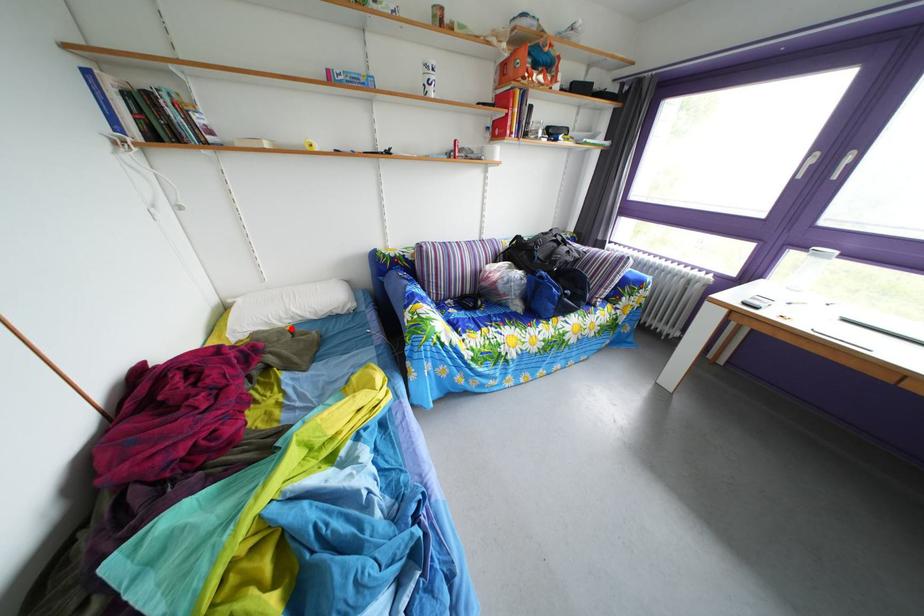
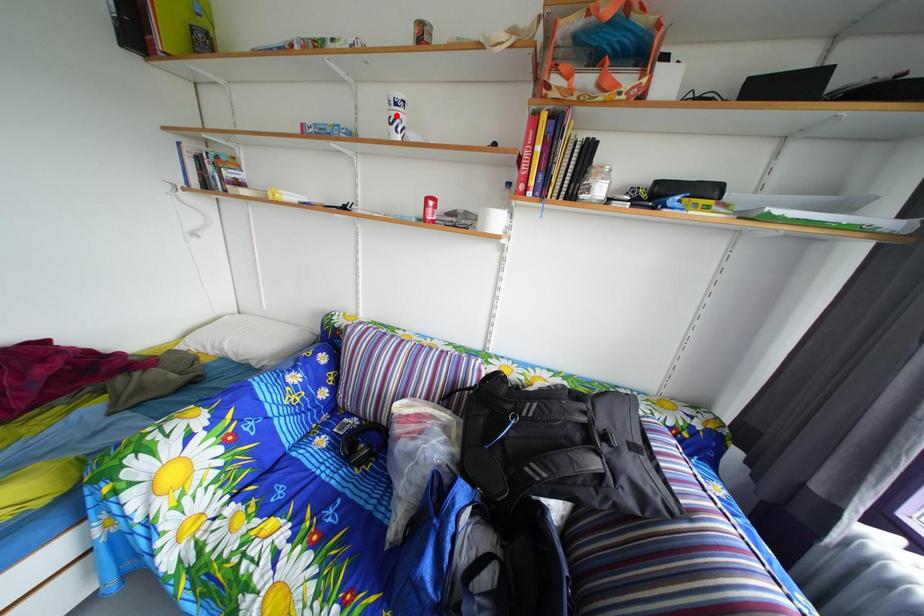
I am providing you with two images of the same scene from different viewpoints. A red point is marked on the first image and another point is marked on the second image. Is the marked point in image1 the same physical position as the marked point in image2?

No